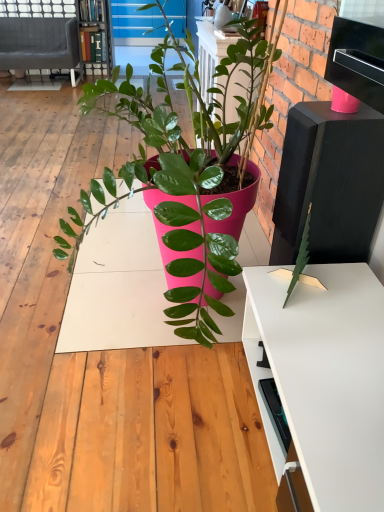
Question: From the image's perspective, relative to wooden bookshelf at upper left, is velvet grey couch at upper left above or below?

Choices:
 (A) above
 (B) below

Answer: (B)

Question: From a real-world perspective, relative to wooden bookshelf at upper left, is velvet grey couch at upper left vertically above or below?

Choices:
 (A) below
 (B) above

Answer: (A)

Question: Is point (76, 39) positioned closer to the camera than point (96, 69)?

Choices:
 (A) farther
 (B) closer

Answer: (A)

Question: In terms of size, does wooden bookshelf at upper left appear bigger or smaller than velvet grey couch at upper left?

Choices:
 (A) small
 (B) big

Answer: (A)

Question: Is wooden bookshelf at upper left taller or shorter than velvet grey couch at upper left?

Choices:
 (A) tall
 (B) short

Answer: (A)

Question: From the image's perspective, relative to velvet grey couch at upper left, is wooden bookshelf at upper left above or below?

Choices:
 (A) above
 (B) below

Answer: (A)

Question: Visually, is wooden bookshelf at upper left positioned to the left or to the right of velvet grey couch at upper left?

Choices:
 (A) right
 (B) left

Answer: (A)